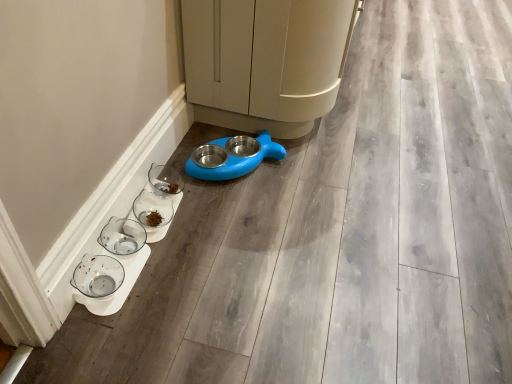
Question: From the image's perspective, is clear glass bowl at lower left, the 2th glass bowl viewed from the back, above blue plastic bowl at lower center?

Choices:
 (A) no
 (B) yes

Answer: (A)

Question: Is clear glass bowl at lower left, the 2th glass bowl viewed from the back, facing towards blue plastic bowl at lower center?

Choices:
 (A) no
 (B) yes

Answer: (A)

Question: Is clear glass bowl at lower left, the 2th glass bowl in the front-to-back sequence, surrounding blue plastic bowl at lower center?

Choices:
 (A) yes
 (B) no

Answer: (B)

Question: Considering the relative positions of clear glass bowl at lower left, the 2th glass bowl in the front-to-back sequence, and blue plastic bowl at lower center in the image provided, is clear glass bowl at lower left, the 2th glass bowl in the front-to-back sequence, to the right of blue plastic bowl at lower center from the viewer's perspective?

Choices:
 (A) no
 (B) yes

Answer: (A)

Question: Would you consider clear glass bowl at lower left, the 2th glass bowl viewed from the back, to be distant from blue plastic bowl at lower center?

Choices:
 (A) no
 (B) yes

Answer: (A)

Question: Considering the relative positions of clear glass bowl at lower left, the 2th glass bowl in the front-to-back sequence, and blue plastic bowl at lower center in the image provided, is clear glass bowl at lower left, the 2th glass bowl in the front-to-back sequence, behind blue plastic bowl at lower center?

Choices:
 (A) no
 (B) yes

Answer: (A)

Question: From a real-world perspective, is blue plastic pet feeder at center under clear glass bowl at lower center, the 3th glass bowl in the front-to-back sequence?

Choices:
 (A) no
 (B) yes

Answer: (B)

Question: Can you confirm if blue plastic pet feeder at center is positioned to the left of clear glass bowl at lower center, the 3th glass bowl in the front-to-back sequence?

Choices:
 (A) yes
 (B) no

Answer: (B)

Question: From the image's perspective, does blue plastic pet feeder at center appear higher than clear glass bowl at lower center, which is the first glass bowl in back-to-front order?

Choices:
 (A) no
 (B) yes

Answer: (B)

Question: Is blue plastic pet feeder at center far from clear glass bowl at lower center, which is the first glass bowl in back-to-front order?

Choices:
 (A) no
 (B) yes

Answer: (A)

Question: Can you confirm if blue plastic pet feeder at center is positioned to the right of clear glass bowl at lower center, which is the first glass bowl in back-to-front order?

Choices:
 (A) yes
 (B) no

Answer: (A)

Question: Is blue plastic pet feeder at center next to clear glass bowl at lower center, which is the first glass bowl in back-to-front order, and touching it?

Choices:
 (A) no
 (B) yes

Answer: (A)

Question: Is blue plastic pet feeder at center inside clear glass bowl at lower left, the 2th glass bowl in the front-to-back sequence?

Choices:
 (A) yes
 (B) no

Answer: (B)